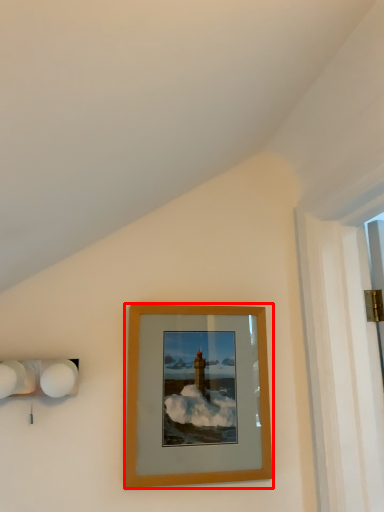
Question: From the image's perspective, what is the correct spatial positioning of picture frame (annotated by the red box) in reference to lamp?

Choices:
 (A) above
 (B) below

Answer: (B)